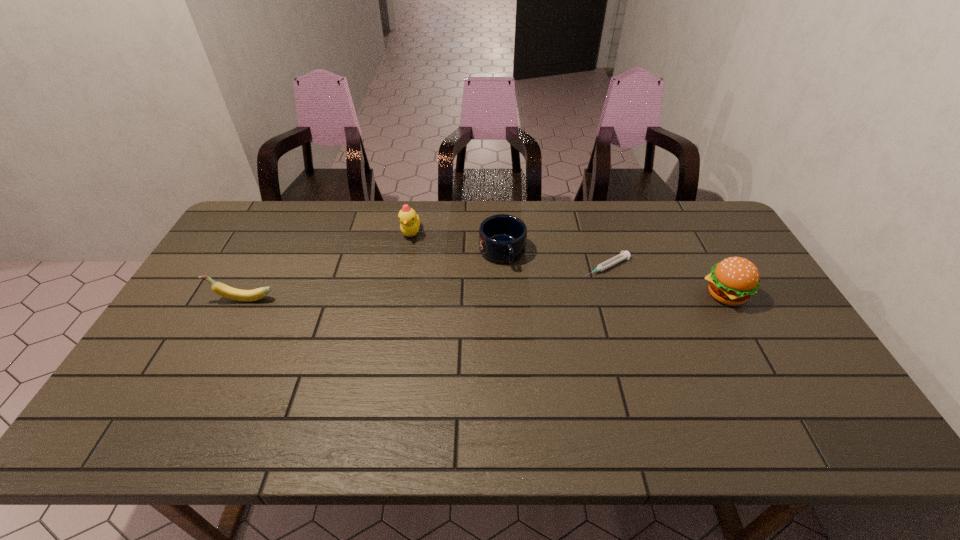
Locate an element on the screen. Image resolution: width=960 pixels, height=540 pixels. vacant area situated 0.390m with the handle on the side of the third object from left to right is located at coordinates (550, 376).

Where is `free space located 0.190m on the front-facing side of the duckling`? This screenshot has width=960, height=540. free space located 0.190m on the front-facing side of the duckling is located at coordinates (422, 282).

This screenshot has width=960, height=540. What are the coordinates of `free location located on the front-facing side of the duckling` in the screenshot? It's located at click(429, 306).

Image resolution: width=960 pixels, height=540 pixels. In order to click on vacant space located 0.250m on the front-facing side of the duckling in this screenshot , I will do `click(426, 296)`.

You are a GUI agent. You are given a task and a screenshot of the screen. Output one action in this format:
    pyautogui.click(x=<x>, y=<y>)
    Task: Click on the blank area located at the needle end of the shortest object
    The width and height of the screenshot is (960, 540).
    Given the screenshot: What is the action you would take?
    pyautogui.click(x=498, y=318)

The height and width of the screenshot is (540, 960). I want to click on free space located 0.260m at the needle end of the shortest object, so click(x=518, y=308).

Identify the location of vacant point located 0.090m at the needle end of the shortest object. (564, 285).

I want to click on mug located in the far edge section of the desktop, so click(502, 238).

Where is `duckling that is at the far edge`? The image size is (960, 540). duckling that is at the far edge is located at coordinates (410, 222).

This screenshot has width=960, height=540. I want to click on object situated at the left edge, so click(219, 288).